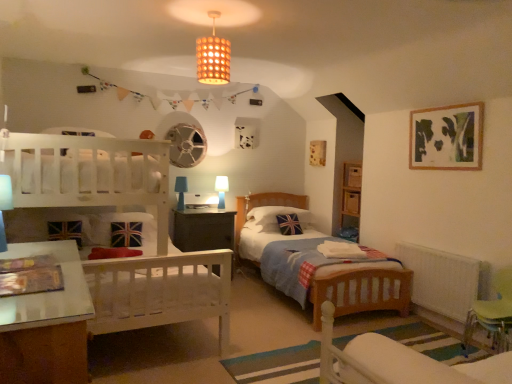
Question: In the image, is green plastic swivel chair at lower right, which appears as the first swivel chair when viewed from the back, on the left side or the right side of blue fabric pillow at center?

Choices:
 (A) left
 (B) right

Answer: (B)

Question: Based on their sizes in the image, would you say green plastic swivel chair at lower right, which appears as the first swivel chair when viewed from the back, is bigger or smaller than blue fabric pillow at center?

Choices:
 (A) small
 (B) big

Answer: (B)

Question: Which of these objects is positioned closest to the white plastic radiator at lower right?

Choices:
 (A) matte brown lampshade at upper center
 (B) green plastic swivel chair at lower right, which appears as the 2th swivel chair when viewed from the right
 (C) green plastic swivel chair at lower right, the 2th swivel chair when ordered from front to back
 (D) wooden lampshade at upper center
 (E) blue fabric pillow at center

Answer: (C)

Question: Based on their relative distances, which object is farther from the blue fabric pillow at center?

Choices:
 (A) wooden drawer at center-right
 (B) dark wood nightstand at center
 (C) white plastic radiator at lower right
 (D) matte brown lampshade at upper center
 (E) wooden lampshade at upper center

Answer: (E)